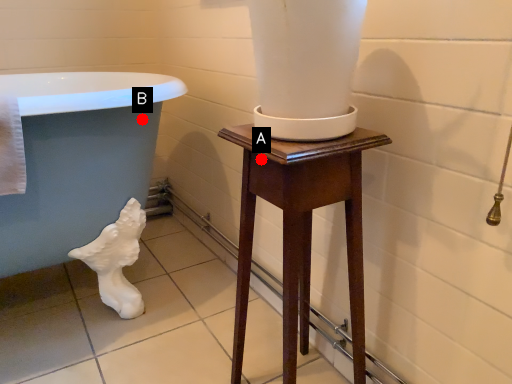
Question: Two points are circled on the image, labeled by A and B beside each circle. Which point is farther to the camera?

Choices:
 (A) A is further
 (B) B is further

Answer: (B)